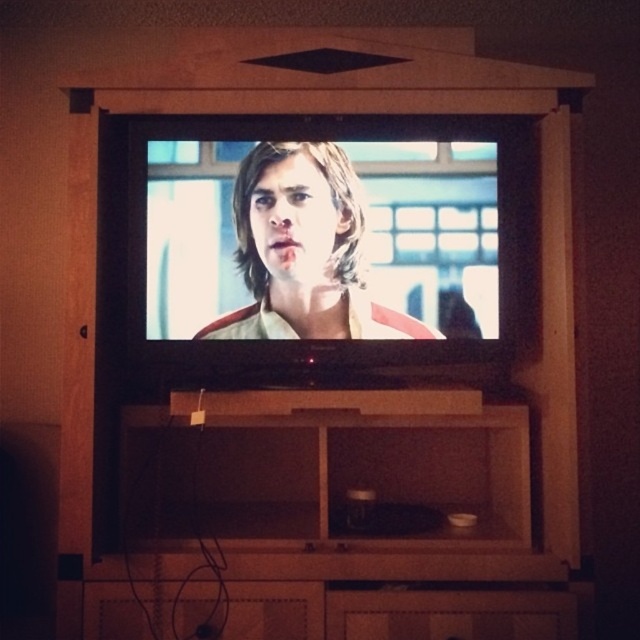
Question: Which point is closer to the camera?

Choices:
 (A) matte wood drawer at lower center
 (B) matte black shirt at center

Answer: (A)

Question: Which point is closer to the camera taking this photo?

Choices:
 (A) (241, 221)
 (B) (486, 620)

Answer: (B)

Question: Considering the relative positions of matte black shirt at center and matte wood drawer at lower center in the image provided, where is matte black shirt at center located with respect to matte wood drawer at lower center?

Choices:
 (A) right
 (B) left

Answer: (B)

Question: Can you confirm if matte black shirt at center is positioned to the right of matte wood drawer at lower center?

Choices:
 (A) no
 (B) yes

Answer: (A)

Question: Can you confirm if matte black shirt at center is positioned to the right of matte wood drawer at lower center?

Choices:
 (A) no
 (B) yes

Answer: (A)